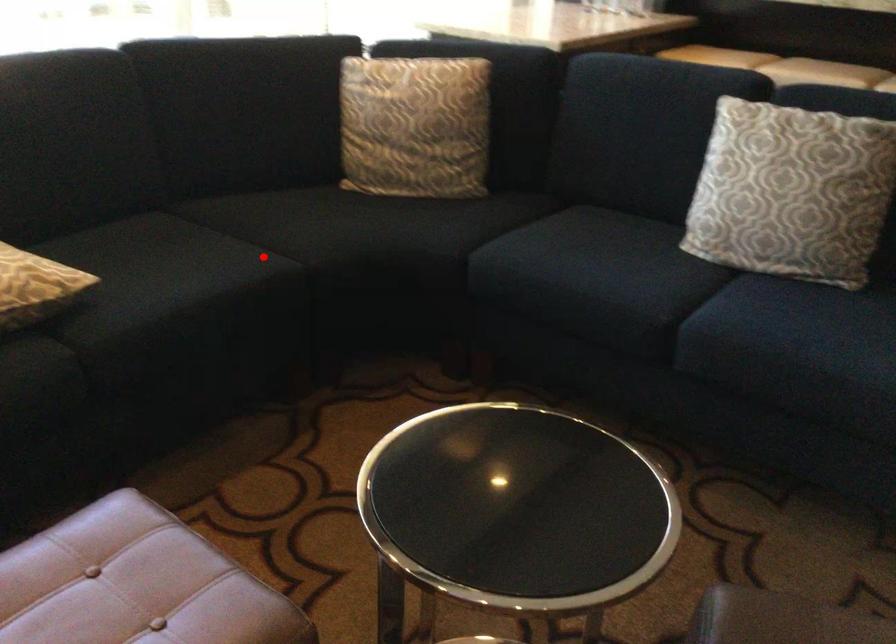
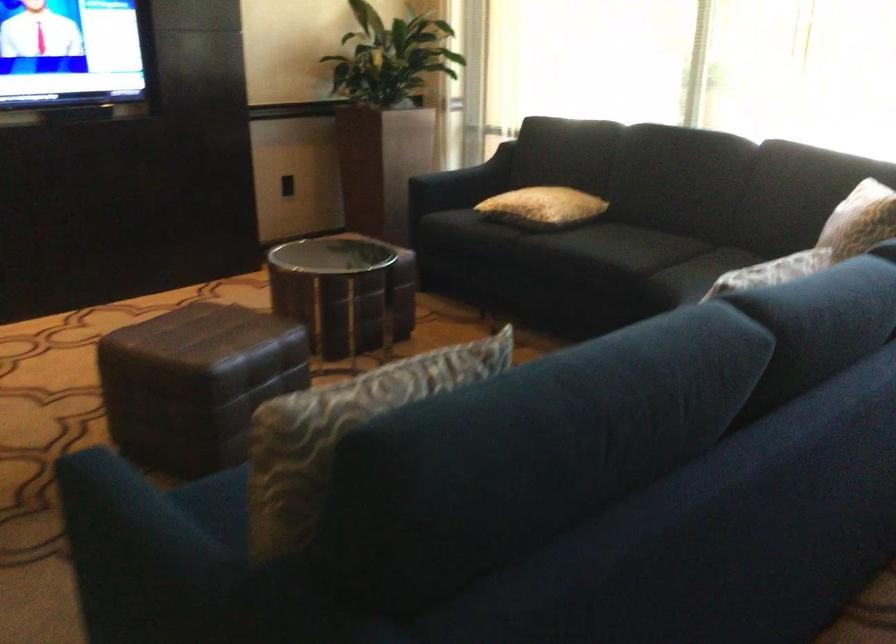
Question: I am providing you with two images of the same scene from different viewpoints. A red point is shown in image1. For the corresponding object point in image2, is it positioned nearer or farther from the camera?

Choices:
 (A) Nearer
 (B) Farther

Answer: (B)